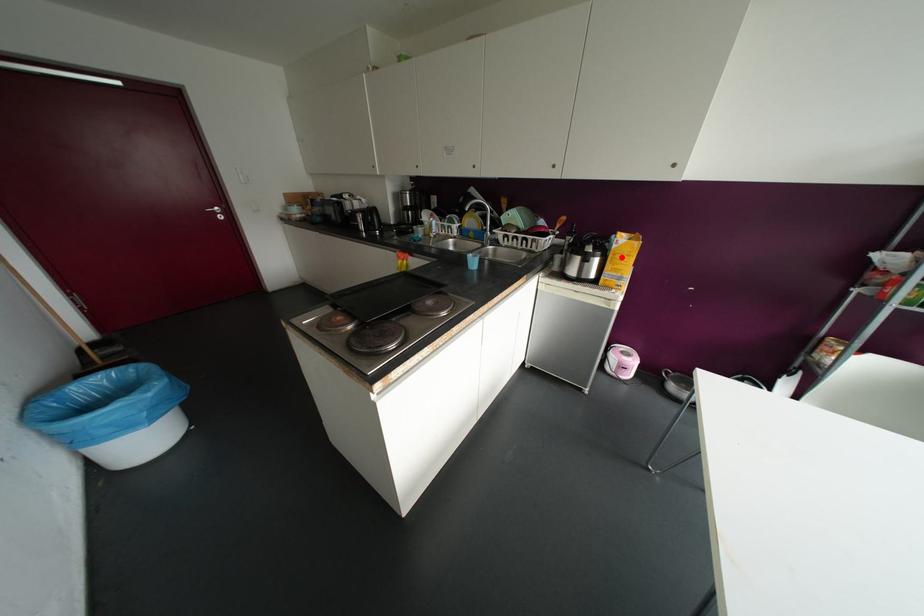
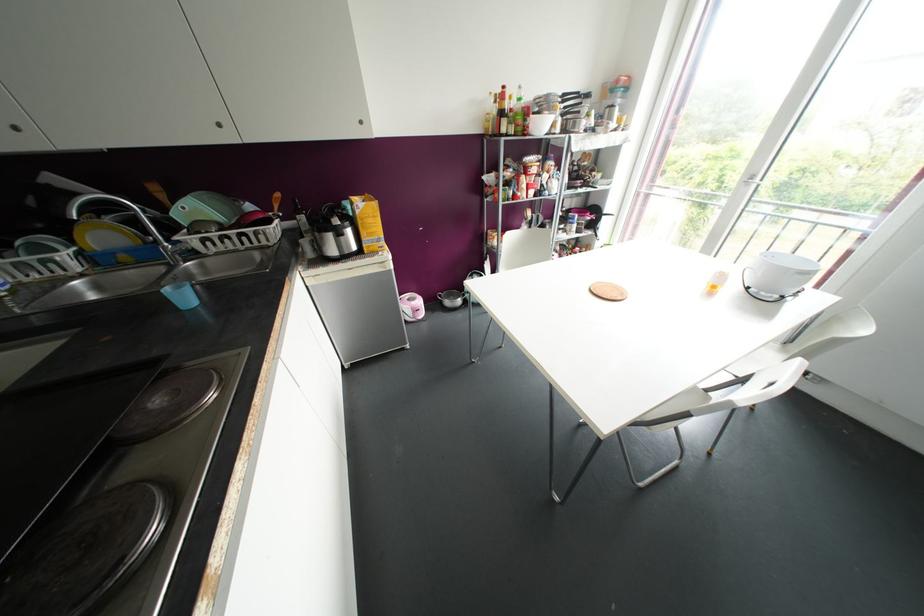
Find the pixel in the second image that matches the highlighted location in the first image.

(370, 220)